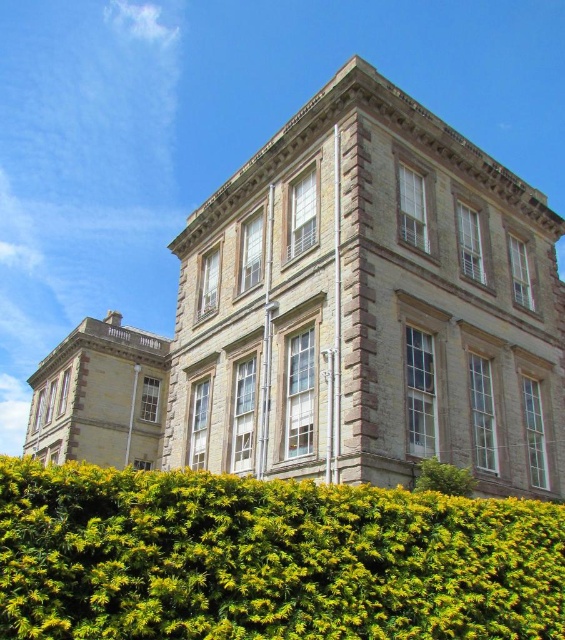
Can you confirm if green leafy hedge at lower center is positioned to the right of green leafy hedge at lower right?

Incorrect, green leafy hedge at lower center is not on the right side of green leafy hedge at lower right.

Between green leafy hedge at lower center and green leafy hedge at lower right, which one is positioned lower?

green leafy hedge at lower center

Is point (437, 618) positioned before point (462, 488)?

Yes, it is in front of point (462, 488).

This screenshot has height=640, width=565. Identify the location of green leafy hedge at lower center. (267, 560).